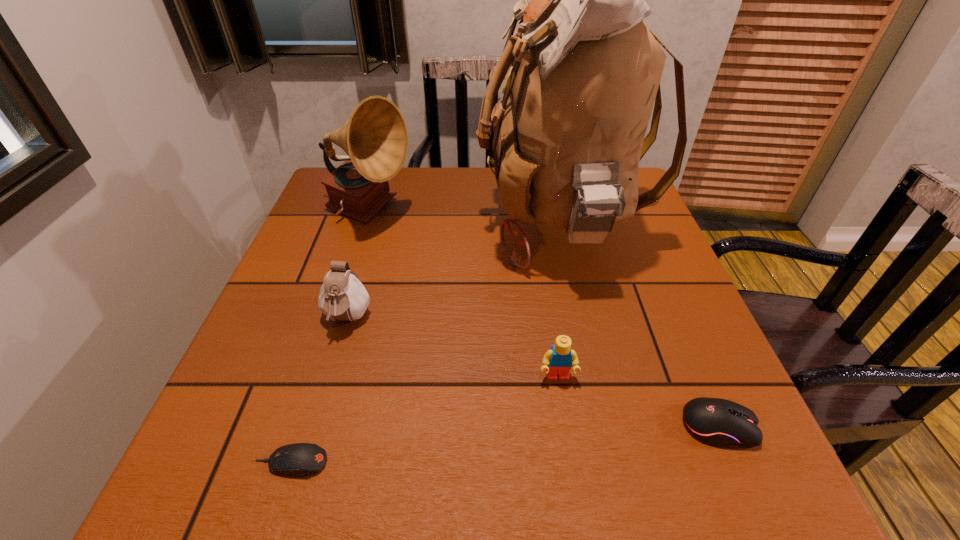
The image size is (960, 540). I want to click on vacant space that's between the right computer mouse and the tallest object, so click(638, 325).

The height and width of the screenshot is (540, 960). In order to click on free spot between the Lego and the fourth shortest object in this screenshot , I will do `click(452, 348)`.

You are a GUI agent. You are given a task and a screenshot of the screen. Output one action in this format:
    pyautogui.click(x=<x>, y=<y>)
    Task: Click on the free space between the pouch and the fifth shortest object
    The width and height of the screenshot is (960, 540).
    Given the screenshot: What is the action you would take?
    359,266

Image resolution: width=960 pixels, height=540 pixels. Identify the location of unoccupied position between the taller computer mouse and the left computer mouse. (505, 444).

This screenshot has width=960, height=540. In order to click on free spot between the third nearest object and the backpack in this screenshot , I will do `click(558, 301)`.

The image size is (960, 540). I want to click on the fifth closest object to the third farthest object, so click(x=719, y=422).

Identify the location of object that is the fourth closest to the fifth tallest object. The width and height of the screenshot is (960, 540). (342, 296).

You are a GUI agent. You are given a task and a screenshot of the screen. Output one action in this format:
    pyautogui.click(x=<x>, y=<y>)
    Task: Click on the free space that satisfies the following two spatial constraints: 1. on the back side of the fifth tallest object; 2. on the front-facing side of the tallest object
    
    Given the screenshot: What is the action you would take?
    pyautogui.click(x=633, y=225)

What are the coordinates of `free space in the image that satisfies the following two spatial constraints: 1. on the front-facing side of the Lego; 2. on the left side of the second shortest object` in the screenshot? It's located at (564, 426).

Find the location of a particular element. The width and height of the screenshot is (960, 540). vacant space that satisfies the following two spatial constraints: 1. on the front-facing side of the second shortest object; 2. on the right side of the fourth nearest object is located at coordinates (316, 426).